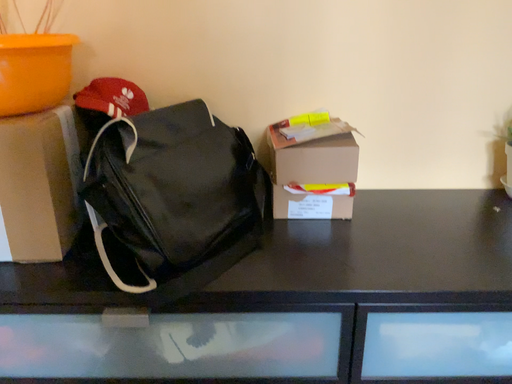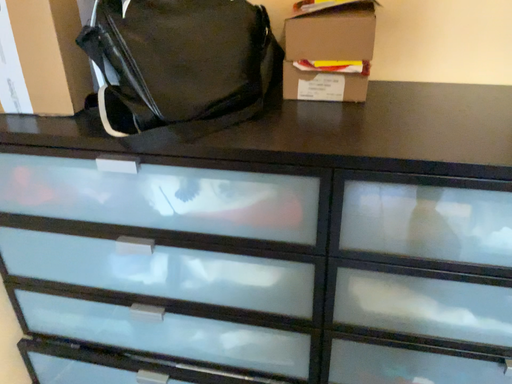
Question: Which way did the camera rotate in the video?

Choices:
 (A) rotated right
 (B) rotated left

Answer: (B)